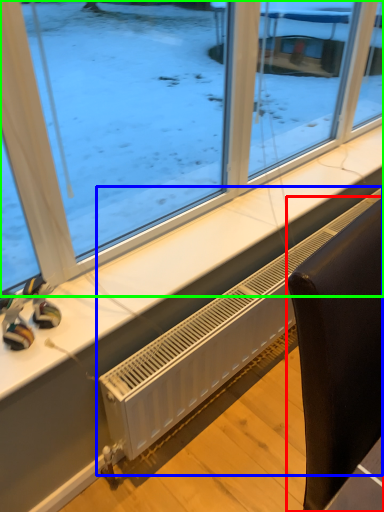
Question: Considering the real-world distances, which object is farthest from furniture (highlighted by a red box)? air conditioning (highlighted by a blue box) or window (highlighted by a green box)?

Choices:
 (A) air conditioning
 (B) window

Answer: (B)